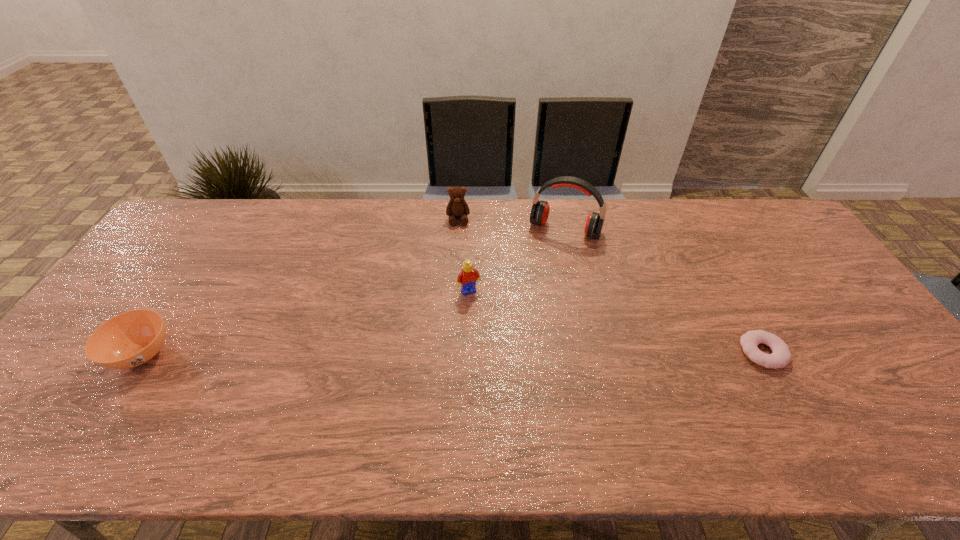
I want to click on vacant space on the desktop that is between the leftmost object and the doughnut and is positioned on the face of the teddy bear, so click(468, 353).

You are a GUI agent. You are given a task and a screenshot of the screen. Output one action in this format:
    pyautogui.click(x=<x>, y=<y>)
    Task: Click on the free space on the desktop that is between the second shortest object and the shortest object and is positioned on the front-facing side of the third nearest object
    
    Given the screenshot: What is the action you would take?
    pyautogui.click(x=499, y=353)

Find the location of `vacant space on the desktop that is between the soup bowl and the rightmost object and is positioned on the ear cups of the fourth object from left to right`. vacant space on the desktop that is between the soup bowl and the rightmost object and is positioned on the ear cups of the fourth object from left to right is located at coordinates (514, 353).